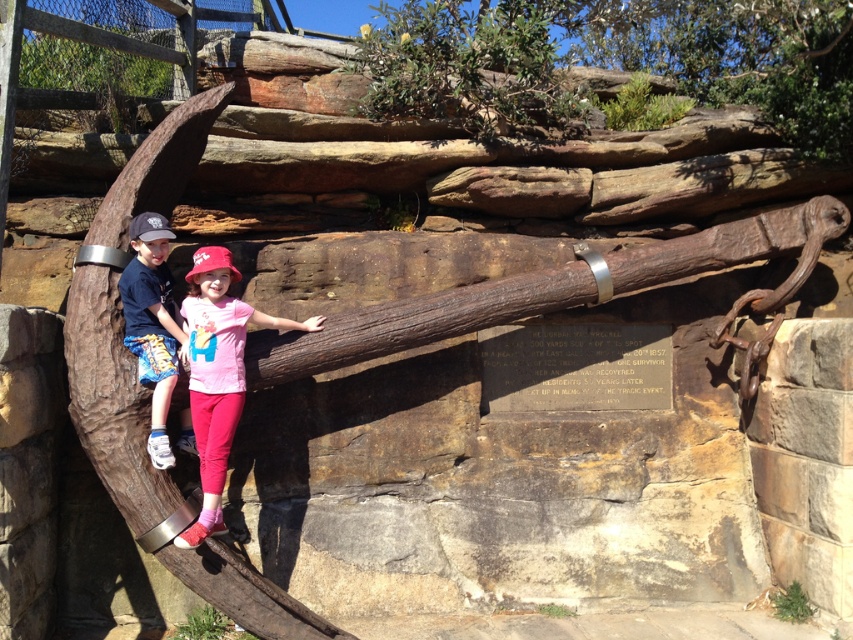
Looking at this image, you are a photographer trying to capture a closeup of both the matte pink shirt at center and the blue denim shorts at left. Given that your camera can only focus on objects within a 9 inch range, will you be able to get both in focus?

The matte pink shirt at center is 9.18 inches away from the blue denim shorts at left. Since the distance between them is slightly over 9 inches, the camera might struggle to keep both in focus simultaneously.

Based on the photo, you are a photographer trying to capture both the matte pink shirt at center and the blue denim shorts at left in a single frame. Given their sizes, which object should you focus on to ensure both are clearly visible in the photo?

The matte pink shirt at center is larger in size than blue denim shorts at left. To ensure both are clearly visible, focus on the matte pink shirt at center since it occupies more space in the frame, allowing the smaller blue denim shorts at left to also be captured in detail.